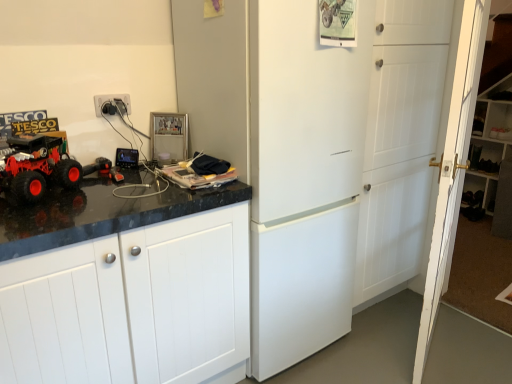
Question: Is white plastic electric outlet at upper left aimed at white matte refrigerator at center?

Choices:
 (A) no
 (B) yes

Answer: (A)

Question: Does white plastic electric outlet at upper left appear on the left side of white matte refrigerator at center?

Choices:
 (A) yes
 (B) no

Answer: (A)

Question: Does white plastic electric outlet at upper left have a lesser height compared to white matte refrigerator at center?

Choices:
 (A) yes
 (B) no

Answer: (A)

Question: Is white plastic electric outlet at upper left smaller than white matte refrigerator at center?

Choices:
 (A) yes
 (B) no

Answer: (A)

Question: Does white plastic electric outlet at upper left come in front of white matte refrigerator at center?

Choices:
 (A) yes
 (B) no

Answer: (B)

Question: Does point (40, 140) appear closer or farther from the camera than point (468, 57)?

Choices:
 (A) closer
 (B) farther

Answer: (A)

Question: Is rubberized red truck at left bigger or smaller than white wooden door at right, marked as the first door in a right-to-left arrangement?

Choices:
 (A) small
 (B) big

Answer: (A)

Question: From a real-world perspective, is rubberized red truck at left positioned above or below white wooden door at right, the 2th door in the left-to-right sequence?

Choices:
 (A) above
 (B) below

Answer: (A)

Question: Is rubberized red truck at left taller or shorter than white wooden door at right, marked as the first door in a right-to-left arrangement?

Choices:
 (A) tall
 (B) short

Answer: (B)

Question: Do you think white matte cabinet at left is within white wooden door at right, the 2th door in the left-to-right sequence, or outside of it?

Choices:
 (A) inside
 (B) outside

Answer: (B)

Question: In the image, is white matte cabinet at left positioned in front of or behind white wooden door at right, the 2th door in the left-to-right sequence?

Choices:
 (A) front
 (B) behind

Answer: (A)

Question: In terms of width, does white matte cabinet at left look wider or thinner when compared to white wooden door at right, the 2th door in the left-to-right sequence?

Choices:
 (A) wide
 (B) thin

Answer: (A)

Question: Would you say white matte cabinet at left is to the left or to the right of white wooden door at right, the 2th door in the left-to-right sequence, in the picture?

Choices:
 (A) right
 (B) left

Answer: (B)

Question: Considering the positions of metallic silver frame at upper center and white matte door at center, which appears as the 1th door when viewed from the left, in the image, is metallic silver frame at upper center bigger or smaller than white matte door at center, which appears as the 1th door when viewed from the left,?

Choices:
 (A) small
 (B) big

Answer: (A)

Question: Is metallic silver frame at upper center taller or shorter than white matte door at center, which appears as the 1th door when viewed from the left?

Choices:
 (A) short
 (B) tall

Answer: (A)